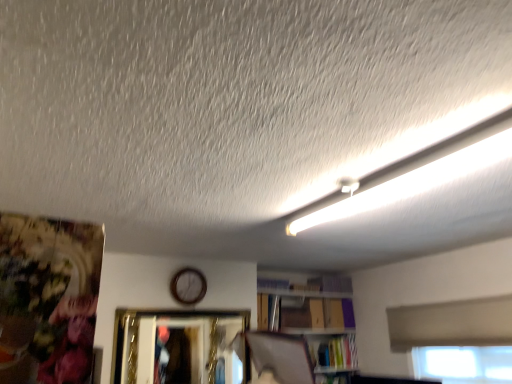
This screenshot has height=384, width=512. What do you see at coordinates (413, 181) in the screenshot?
I see `white fluorescent tube at upper right` at bounding box center [413, 181].

Measure the distance between hardcover book at lower right and camera.

hardcover book at lower right and camera are 4.19 meters apart.

What is the approximate width of gold metallic picture frame at center?

7.61 centimeters.

The image size is (512, 384). I want to click on wooden clock at center, so click(x=188, y=286).

You are a GUI agent. You are given a task and a screenshot of the screen. Output one action in this format:
    pyautogui.click(x=<x>, y=<y>)
    Task: Click on the white fluorescent tube at upper right
    
    Given the screenshot: What is the action you would take?
    pyautogui.click(x=413, y=181)

Is gold metallic picture frame at center smaller than wooden clock at center?

No, gold metallic picture frame at center is not smaller than wooden clock at center.

Where is `clock to the left of gold metallic picture frame at center`? The width and height of the screenshot is (512, 384). clock to the left of gold metallic picture frame at center is located at coordinates (188, 286).

Could you tell me if gold metallic picture frame at center is turned towards wooden clock at center?

No, gold metallic picture frame at center does not turn towards wooden clock at center.

Is gold metallic picture frame at center not inside wooden clock at center?

Yes, gold metallic picture frame at center is not within wooden clock at center.

Choose the correct answer: Is hardcover book at lower right inside wooden clock at center or outside it?

hardcover book at lower right is not inside wooden clock at center, it's outside.

Is hardcover book at lower right in contact with wooden clock at center?

They are not placed beside each other.

From a real-world perspective, who is located lower, hardcover book at lower right or wooden clock at center?

hardcover book at lower right is physically lower.

Based on their positions, is hardcover book at lower right located to the left or right of wooden clock at center?

Clearly, hardcover book at lower right is on the right of wooden clock at center in the image.

From the image's perspective, which is below, gold metallic picture frame at center or white fluorescent tube at upper right?

gold metallic picture frame at center.

In the scene shown: Which point is more distant from viewer, [174,325] or [391,185]?

The point [174,325] is more distant.

Which of these two, gold metallic picture frame at center or white fluorescent tube at upper right, is bigger?

gold metallic picture frame at center is bigger.

Considering the relative sizes of gold metallic picture frame at center and white fluorescent tube at upper right in the image provided, is gold metallic picture frame at center thinner than white fluorescent tube at upper right?

Indeed, gold metallic picture frame at center has a lesser width compared to white fluorescent tube at upper right.

Considering the positions of objects wooden clock at center and gold metallic picture frame at center in the image provided, who is more to the left, wooden clock at center or gold metallic picture frame at center?

wooden clock at center.

From the image's perspective, which object appears higher, wooden clock at center or gold metallic picture frame at center?

wooden clock at center, from the image's perspective.

Which object is closer to the camera taking this photo, wooden clock at center or gold metallic picture frame at center?

Positioned in front is gold metallic picture frame at center.

Which of these two, wooden clock at center or gold metallic picture frame at center, is wider?

gold metallic picture frame at center is wider.

Are white fluorescent tube at upper right and hardcover book at lower right far apart?

Indeed, white fluorescent tube at upper right is not near hardcover book at lower right.

Considering the points (483, 159) and (332, 337), which point is behind, point (483, 159) or point (332, 337)?

The point (332, 337) is farther from the camera.

Can you tell me how much white fluorescent tube at upper right and hardcover book at lower right differ in facing direction?

The angular difference between white fluorescent tube at upper right and hardcover book at lower right is 88.7 degrees.

Considering the positions of objects white fluorescent tube at upper right and hardcover book at lower right in the image provided, who is in front, white fluorescent tube at upper right or hardcover book at lower right?

Positioned in front is white fluorescent tube at upper right.

Considering the relative positions of wooden clock at center and white fluorescent tube at upper right in the image provided, is wooden clock at center to the left or to the right of white fluorescent tube at upper right?

In the image, wooden clock at center appears on the left side of white fluorescent tube at upper right.

From the image's perspective, would you say wooden clock at center is shown under white fluorescent tube at upper right?

Indeed, from the image's perspective, wooden clock at center is shown beneath white fluorescent tube at upper right.

Locate an element on the screen. This screenshot has height=384, width=512. lighting in front of the wooden clock at center is located at coordinates (413, 181).

Is gold metallic picture frame at center located outside hardcover book at lower right?

Yes, gold metallic picture frame at center is located beyond the bounds of hardcover book at lower right.

Does point (126, 373) come farther from viewer compared to point (345, 342)?

No, it is not.

Is gold metallic picture frame at center thinner than hardcover book at lower right?

Indeed, gold metallic picture frame at center has a lesser width compared to hardcover book at lower right.

From the image's perspective, does gold metallic picture frame at center appear lower than hardcover book at lower right?

No, from the image's perspective, gold metallic picture frame at center is not beneath hardcover book at lower right.

The height and width of the screenshot is (384, 512). What are the coordinates of `picture frame that appears below the wooden clock at center (from the image's perspective)` in the screenshot? It's located at (180, 347).

I want to click on clock in front of the hardcover book at lower right, so click(188, 286).

Looking at the image, which one is located further to white fluorescent tube at upper right, wooden clock at center or gold metallic picture frame at center?

The object further to white fluorescent tube at upper right is wooden clock at center.

When comparing their distances from hardcover book at lower right, does wooden clock at center or gold metallic picture frame at center seem further?

wooden clock at center lies further to hardcover book at lower right than the other object.

When comparing their distances from wooden clock at center, does hardcover book at lower right or gold metallic picture frame at center seem closer?

gold metallic picture frame at center is closer to wooden clock at center.

Looking at the image, which one is located further to white fluorescent tube at upper right, hardcover book at lower right or wooden clock at center?

Based on the image, hardcover book at lower right appears to be further to white fluorescent tube at upper right.

Estimate the real-world distances between objects in this image. Which object is further from hardcover book at lower right, white fluorescent tube at upper right or wooden clock at center?

white fluorescent tube at upper right.

From the picture: Considering their positions, is hardcover book at lower right positioned closer to white fluorescent tube at upper right than gold metallic picture frame at center?

gold metallic picture frame at center is positioned closer to the anchor white fluorescent tube at upper right.

From the image, which object appears to be nearer to gold metallic picture frame at center, wooden clock at center or white fluorescent tube at upper right?

wooden clock at center lies closer to gold metallic picture frame at center than the other object.

Looking at the image, which one is located closer to gold metallic picture frame at center, white fluorescent tube at upper right or wooden clock at center?

The object closer to gold metallic picture frame at center is wooden clock at center.

The height and width of the screenshot is (384, 512). What are the coordinates of `picture frame between white fluorescent tube at upper right and wooden clock at center along the z-axis` in the screenshot? It's located at (180, 347).

Where is `picture frame between wooden clock at center and hardcover book at lower right from left to right`? This screenshot has width=512, height=384. picture frame between wooden clock at center and hardcover book at lower right from left to right is located at coordinates (180, 347).

In order to click on clock between white fluorescent tube at upper right and hardcover book at lower right from front to back in this screenshot , I will do coord(188,286).

What are the coordinates of `picture frame between white fluorescent tube at upper right and hardcover book at lower right along the z-axis` in the screenshot? It's located at (180, 347).